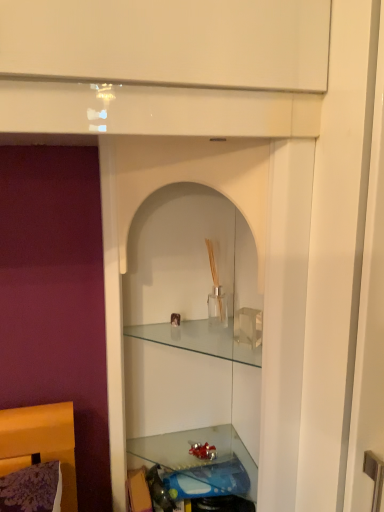
What is the approximate width of clear glass cabinet at center, marked as the second cabinet in a top-to-bottom arrangement?

clear glass cabinet at center, marked as the second cabinet in a top-to-bottom arrangement, is 15.55 inches wide.

Measure the distance between point [132,443] and camera.

1.18 meters.

The image size is (384, 512). What do you see at coordinates (199, 464) in the screenshot?
I see `translucent glass shelf at lower center` at bounding box center [199, 464].

Image resolution: width=384 pixels, height=512 pixels. Find the location of `clear glass vase at center, the first cabinet viewed from the top`. clear glass vase at center, the first cabinet viewed from the top is located at coordinates click(203, 339).

Could you measure the distance between translucent glass shelf at lower center and clear glass cabinet at center, marked as the 1th cabinet in a bottom-to-top arrangement?

translucent glass shelf at lower center and clear glass cabinet at center, marked as the 1th cabinet in a bottom-to-top arrangement, are 12.97 inches apart from each other.

Is translucent glass shelf at lower center not within clear glass cabinet at center, marked as the 1th cabinet in a bottom-to-top arrangement?

No.

From a real-world perspective, which is physically below, translucent glass shelf at lower center or clear glass cabinet at center, marked as the second cabinet in a top-to-bottom arrangement?

translucent glass shelf at lower center, from a real-world perspective.

Considering the positions of points (229, 426) and (202, 154), is point (229, 426) farther from camera compared to point (202, 154)?

Yes, it is behind point (202, 154).

Consider the image. Considering the sizes of clear glass cabinet at center, marked as the 1th cabinet in a bottom-to-top arrangement, and translucent glass shelf at lower center in the image, is clear glass cabinet at center, marked as the 1th cabinet in a bottom-to-top arrangement, taller or shorter than translucent glass shelf at lower center?

In the image, clear glass cabinet at center, marked as the 1th cabinet in a bottom-to-top arrangement, appears to be taller than translucent glass shelf at lower center.

Considering the relative positions of clear glass cabinet at center, marked as the 1th cabinet in a bottom-to-top arrangement, and translucent glass shelf at lower center in the image provided, is clear glass cabinet at center, marked as the 1th cabinet in a bottom-to-top arrangement, to the left of translucent glass shelf at lower center from the viewer's perspective?

Indeed, clear glass cabinet at center, marked as the 1th cabinet in a bottom-to-top arrangement, is positioned on the left side of translucent glass shelf at lower center.

Considering the relative positions of clear glass cabinet at center, marked as the 1th cabinet in a bottom-to-top arrangement, and translucent glass shelf at lower center in the image provided, is clear glass cabinet at center, marked as the 1th cabinet in a bottom-to-top arrangement, behind translucent glass shelf at lower center?

No, the depth of clear glass cabinet at center, marked as the 1th cabinet in a bottom-to-top arrangement, is less than that of translucent glass shelf at lower center.

Is translucent glass shelf at lower center at the back of clear glass cabinet at center, marked as the second cabinet in a top-to-bottom arrangement?

Yes, translucent glass shelf at lower center is at the back of clear glass cabinet at center, marked as the second cabinet in a top-to-bottom arrangement.

Is clear glass vase at center, the first cabinet viewed from the top, taller or shorter than clear glass cabinet at center, marked as the 1th cabinet in a bottom-to-top arrangement?

clear glass vase at center, the first cabinet viewed from the top, is shorter than clear glass cabinet at center, marked as the 1th cabinet in a bottom-to-top arrangement.

Which is behind, point (165, 323) or point (140, 173)?

The point (165, 323) is behind.

Is clear glass vase at center, the first cabinet viewed from the top, with clear glass cabinet at center, marked as the 1th cabinet in a bottom-to-top arrangement?

clear glass vase at center, the first cabinet viewed from the top, and clear glass cabinet at center, marked as the 1th cabinet in a bottom-to-top arrangement, are clearly separated.

From a real-world perspective, which object rests below the other?

In real-world perspective, clear glass cabinet at center, marked as the second cabinet in a top-to-bottom arrangement, is lower.

Could you tell me if clear glass cabinet at center, marked as the second cabinet in a top-to-bottom arrangement, is turned towards clear glass vase at center, which ranks as the second cabinet in bottom-to-top order?

Yes, clear glass cabinet at center, marked as the second cabinet in a top-to-bottom arrangement, is turned towards clear glass vase at center, which ranks as the second cabinet in bottom-to-top order.

Between clear glass cabinet at center, marked as the second cabinet in a top-to-bottom arrangement, and clear glass vase at center, the first cabinet viewed from the top, which one has larger width?

clear glass cabinet at center, marked as the second cabinet in a top-to-bottom arrangement, is wider.

Considering the positions of objects clear glass cabinet at center, marked as the 1th cabinet in a bottom-to-top arrangement, and clear glass vase at center, the first cabinet viewed from the top, in the image provided, who is behind, clear glass cabinet at center, marked as the 1th cabinet in a bottom-to-top arrangement, or clear glass vase at center, the first cabinet viewed from the top,?

clear glass vase at center, the first cabinet viewed from the top, is further from the camera.

Locate an element on the screen. The width and height of the screenshot is (384, 512). cabinet that is on the right side of translucent glass shelf at lower center is located at coordinates (203, 339).

Is clear glass vase at center, which ranks as the second cabinet in bottom-to-top order, situated inside translucent glass shelf at lower center or outside?

clear glass vase at center, which ranks as the second cabinet in bottom-to-top order, is located beyond the bounds of translucent glass shelf at lower center.

From the picture: Considering the sizes of objects clear glass vase at center, the first cabinet viewed from the top, and translucent glass shelf at lower center in the image provided, who is thinner, clear glass vase at center, the first cabinet viewed from the top, or translucent glass shelf at lower center?

clear glass vase at center, the first cabinet viewed from the top, is thinner.

Could you tell me if translucent glass shelf at lower center is turned towards clear glass vase at center, which ranks as the second cabinet in bottom-to-top order?

No, translucent glass shelf at lower center is not turned towards clear glass vase at center, which ranks as the second cabinet in bottom-to-top order.

Considering the sizes of objects translucent glass shelf at lower center and clear glass vase at center, the first cabinet viewed from the top, in the image provided, who is shorter, translucent glass shelf at lower center or clear glass vase at center, the first cabinet viewed from the top,?

translucent glass shelf at lower center is shorter.

Considering the sizes of objects translucent glass shelf at lower center and clear glass vase at center, which ranks as the second cabinet in bottom-to-top order, in the image provided, who is smaller, translucent glass shelf at lower center or clear glass vase at center, which ranks as the second cabinet in bottom-to-top order,?

clear glass vase at center, which ranks as the second cabinet in bottom-to-top order, is smaller.

From the image's perspective, which is below, translucent glass shelf at lower center or clear glass vase at center, which ranks as the second cabinet in bottom-to-top order?

From the image's view, translucent glass shelf at lower center is below.

In order to click on the 1st cabinet above the translucent glass shelf at lower center (from the image's perspective) in this screenshot , I will do `click(134, 213)`.

Where is `cabinet on the left of the translucent glass shelf at lower center`? cabinet on the left of the translucent glass shelf at lower center is located at coordinates point(134,213).

From the image, which object appears to be farther from translucent glass shelf at lower center, clear glass cabinet at center, marked as the 1th cabinet in a bottom-to-top arrangement, or clear glass vase at center, the first cabinet viewed from the top?

The object further to translucent glass shelf at lower center is clear glass cabinet at center, marked as the 1th cabinet in a bottom-to-top arrangement.

Looking at the image, which one is located closer to clear glass cabinet at center, marked as the 1th cabinet in a bottom-to-top arrangement, translucent glass shelf at lower center or clear glass vase at center, which ranks as the second cabinet in bottom-to-top order?

Among the two, clear glass vase at center, which ranks as the second cabinet in bottom-to-top order, is located nearer to clear glass cabinet at center, marked as the 1th cabinet in a bottom-to-top arrangement.

When comparing their distances from clear glass vase at center, which ranks as the second cabinet in bottom-to-top order, does translucent glass shelf at lower center or clear glass cabinet at center, marked as the 1th cabinet in a bottom-to-top arrangement, seem closer?

clear glass cabinet at center, marked as the 1th cabinet in a bottom-to-top arrangement, lies closer to clear glass vase at center, which ranks as the second cabinet in bottom-to-top order, than the other object.

Considering their positions, is clear glass cabinet at center, marked as the second cabinet in a top-to-bottom arrangement, positioned further to clear glass vase at center, which ranks as the second cabinet in bottom-to-top order, than translucent glass shelf at lower center?

translucent glass shelf at lower center lies further to clear glass vase at center, which ranks as the second cabinet in bottom-to-top order, than the other object.

In the scene shown: Considering their positions, is clear glass vase at center, the first cabinet viewed from the top, positioned further to translucent glass shelf at lower center than clear glass cabinet at center, marked as the 1th cabinet in a bottom-to-top arrangement?

clear glass cabinet at center, marked as the 1th cabinet in a bottom-to-top arrangement.

From the image, which object appears to be farther from clear glass cabinet at center, marked as the 1th cabinet in a bottom-to-top arrangement, clear glass vase at center, the first cabinet viewed from the top, or translucent glass shelf at lower center?

translucent glass shelf at lower center is positioned further to the anchor clear glass cabinet at center, marked as the 1th cabinet in a bottom-to-top arrangement.

I want to click on cabinet between clear glass vase at center, the first cabinet viewed from the top, and translucent glass shelf at lower center from top to bottom, so click(x=134, y=213).